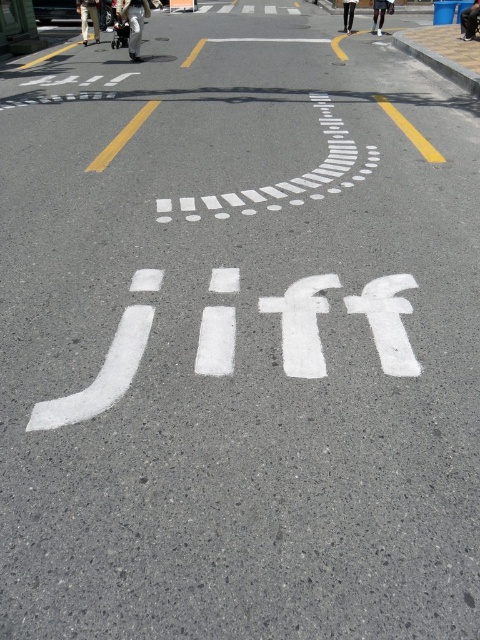
You are a pedestrian trying to cross the street at the crosswalk. You notice two people in the image, one wearing khaki pants at center and another in black pants at upper right. Which person is wearing wider pants?

The khaki pants at center are wider than the black pants at upper right.

Looking at this image, you are standing at the crosswalk area looking up the street towards the word painted on the road. There are two points marked on the road ahead of you at coordinates point (475, 19) and point (380, 29). Which point is closer to your current position?

Point (475, 19) is closer to the camera than point (380, 29), so the point (475, 19) is closer to your current position.